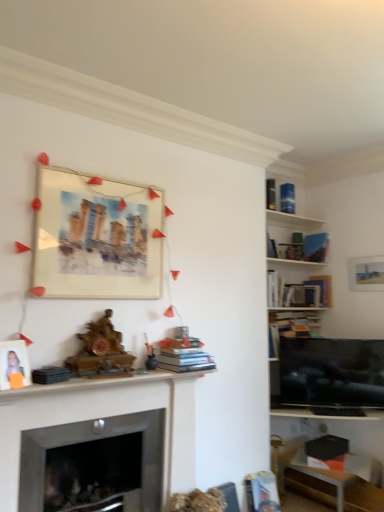
Question: Would you say hardcover book at lower right, which is counted as the second book, starting from the front, contains matte white photo frame at left, arranged as the 2th picture frame when viewed from the top?

Choices:
 (A) no
 (B) yes

Answer: (A)

Question: Considering the relative sizes of hardcover book at lower right, the 5th book in the right-to-left sequence, and matte white photo frame at left, the 2th picture frame viewed from the right, in the image provided, is hardcover book at lower right, the 5th book in the right-to-left sequence, thinner than matte white photo frame at left, the 2th picture frame viewed from the right,?

Choices:
 (A) no
 (B) yes

Answer: (A)

Question: Considering the relative sizes of hardcover book at lower right, the 5th book in the right-to-left sequence, and matte white photo frame at left, arranged as the 1th picture frame when viewed from the left, in the image provided, is hardcover book at lower right, the 5th book in the right-to-left sequence, bigger than matte white photo frame at left, arranged as the 1th picture frame when viewed from the left,?

Choices:
 (A) no
 (B) yes

Answer: (B)

Question: From the image's perspective, is hardcover book at lower right, which is counted as the fifth book, starting from the back, beneath matte white photo frame at left, which is counted as the 1th picture frame, starting from the bottom?

Choices:
 (A) no
 (B) yes

Answer: (B)

Question: Is hardcover book at lower right, acting as the sixth book starting from the top, positioned before matte white photo frame at left, the first picture frame viewed from the front?

Choices:
 (A) yes
 (B) no

Answer: (B)

Question: Is hardcover book at lower right, which is counted as the second book, starting from the front, taller than matte white photo frame at left, which is counted as the 1th picture frame, starting from the bottom?

Choices:
 (A) yes
 (B) no

Answer: (A)

Question: From the image's perspective, would you say hardcover books at center, which is the 5th book from top to bottom, is positioned over wooden mantelpiece at center?

Choices:
 (A) no
 (B) yes

Answer: (B)

Question: Is hardcover books at center, which is counted as the second book, starting from the bottom, outside wooden mantelpiece at center?

Choices:
 (A) yes
 (B) no

Answer: (A)

Question: Is hardcover books at center, the first book in the left-to-right sequence, far away from wooden mantelpiece at center?

Choices:
 (A) no
 (B) yes

Answer: (A)

Question: Is wooden mantelpiece at center a part of hardcover books at center, acting as the sixth book starting from the right?

Choices:
 (A) yes
 (B) no

Answer: (B)

Question: Considering the relative sizes of hardcover books at center, arranged as the first book when viewed from the front, and wooden mantelpiece at center in the image provided, is hardcover books at center, arranged as the first book when viewed from the front, bigger than wooden mantelpiece at center?

Choices:
 (A) no
 (B) yes

Answer: (A)

Question: Considering the relative sizes of hardcover books at center, positioned as the 6th book in back-to-front order, and wooden mantelpiece at center in the image provided, is hardcover books at center, positioned as the 6th book in back-to-front order, thinner than wooden mantelpiece at center?

Choices:
 (A) no
 (B) yes

Answer: (A)

Question: Does hardcover book at upper right, arranged as the second book when viewed from the top, have a greater width compared to hardcover book at center-right, the 5th book positioned from the left?

Choices:
 (A) no
 (B) yes

Answer: (A)